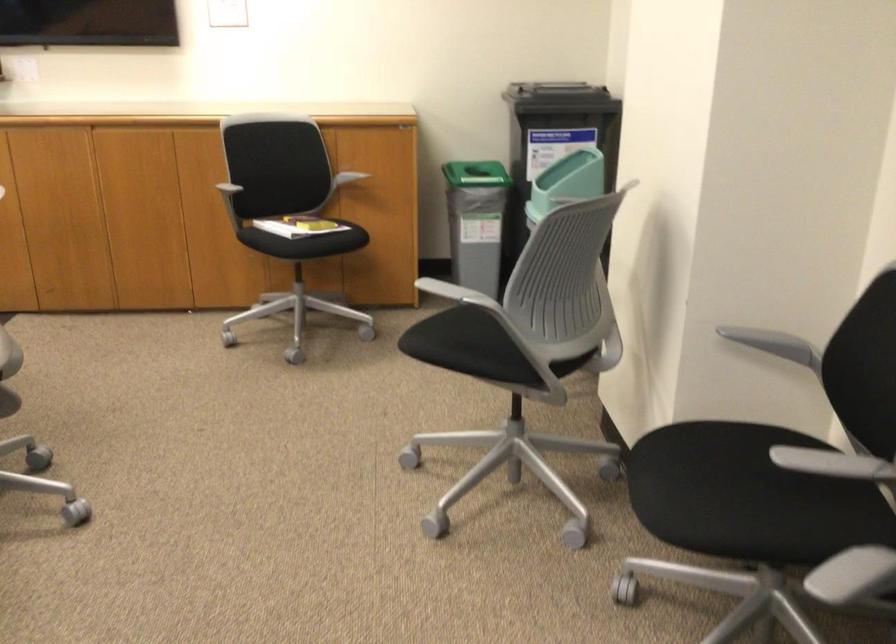
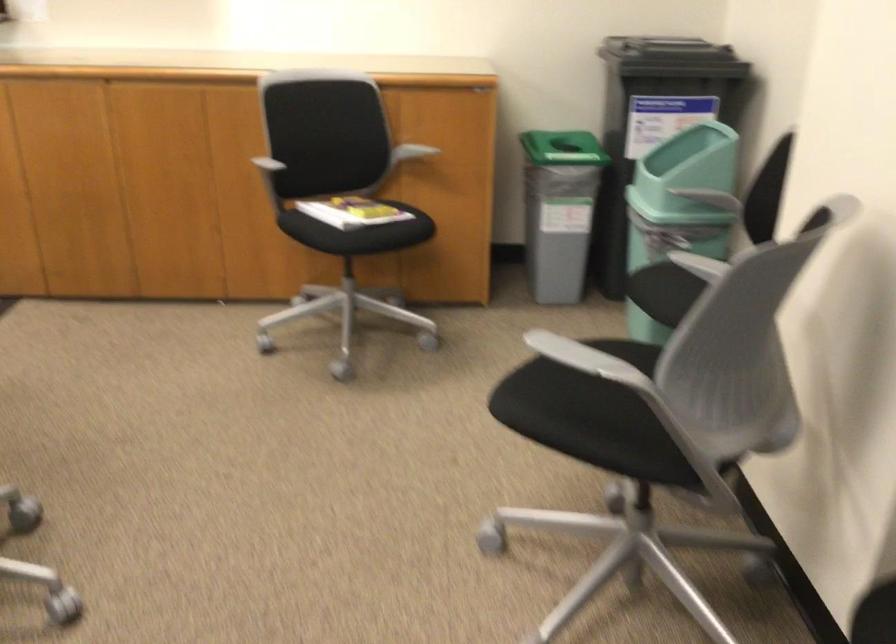
Question: Which direction would the cameraman need to move to produce the second image? Reply with the corresponding letter.

Choices:
 (A) Left
 (B) Right
 (C) Forward
 (D) Backward

Answer: (C)